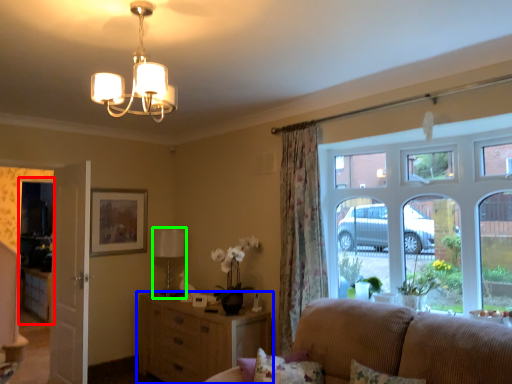
Question: Which object is the closest to the glass door (highlighted by a red box)? Choose among these: cabinetry (highlighted by a blue box) or lamp (highlighted by a green box).

Choices:
 (A) cabinetry
 (B) lamp

Answer: (B)